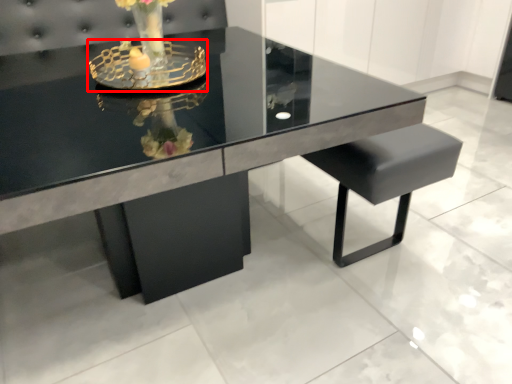
Question: Where is candle holder (annotated by the red box) located in relation to table in the image?

Choices:
 (A) right
 (B) left

Answer: (A)